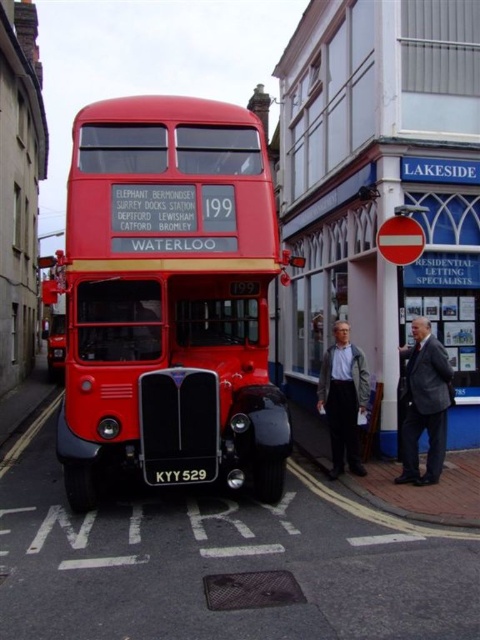
You are a tailor who needs to measure the gray fabric jacket at lower center and the black matte license plate at center for a custom order. Which object is wider?

The gray fabric jacket at lower center is narrower than the black matte license plate at center, so the license plate is wider.

You are a photographer standing in front of the classic red double decker bus. You notice a dark gray suit at center and a black matte license plate at center. Which object is taller?

The dark gray suit at center is taller than the black matte license plate at center.